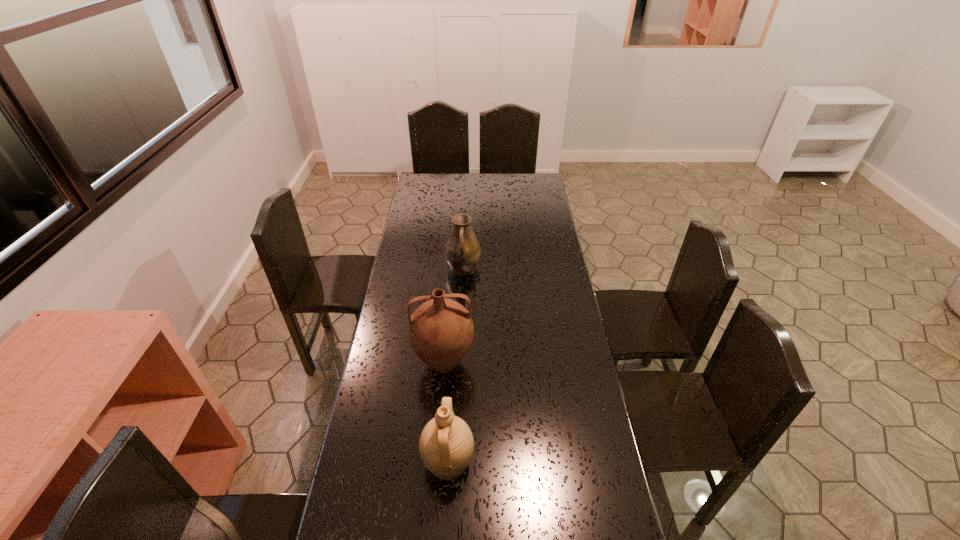
Where is `the second nearest pitcher`? The height and width of the screenshot is (540, 960). the second nearest pitcher is located at coordinates 441,330.

Locate an element on the screen. This screenshot has width=960, height=540. the second nearest object is located at coordinates tap(441, 330).

Where is `the nearest pitcher`? The width and height of the screenshot is (960, 540). the nearest pitcher is located at coordinates pyautogui.click(x=446, y=444).

What are the coordinates of `the farthest object` in the screenshot? It's located at (462, 251).

The image size is (960, 540). Find the location of `free space located 0.090m on the left of the tallest pitcher`. free space located 0.090m on the left of the tallest pitcher is located at coordinates (388, 363).

In order to click on vacant space located 0.360m on the back of the nearest pitcher in this screenshot , I will do `click(455, 345)`.

Locate an element on the screen. This screenshot has height=540, width=960. vacant position located on the handle side of the farthest pitcher is located at coordinates (460, 336).

The width and height of the screenshot is (960, 540). In order to click on object that is at the left edge in this screenshot , I will do `click(441, 330)`.

Where is `free spot at the far edge of the desktop`? free spot at the far edge of the desktop is located at coordinates (x=487, y=189).

You are a GUI agent. You are given a task and a screenshot of the screen. Output one action in this format:
    pyautogui.click(x=<x>, y=<y>)
    Task: Click on the vacant area at the left edge
    This screenshot has height=540, width=960.
    Given the screenshot: What is the action you would take?
    pyautogui.click(x=426, y=204)